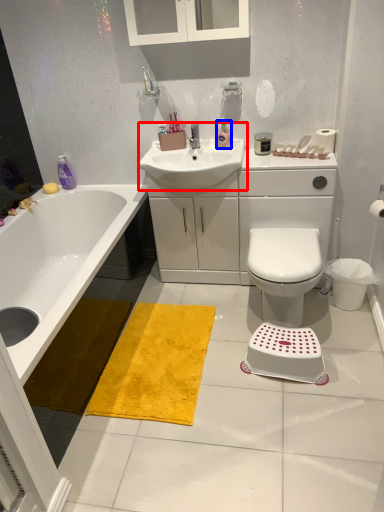
Question: Which object appears farthest to the camera in this image, sink (highlighted by a red box) or toiletry (highlighted by a blue box)?

Choices:
 (A) sink
 (B) toiletry

Answer: (B)